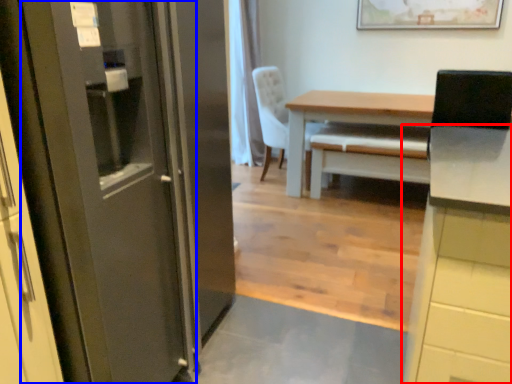
Question: Which of the following is the closest to the observer, cabinetry (highlighted by a red box) or door (highlighted by a blue box)?

Choices:
 (A) cabinetry
 (B) door

Answer: (B)